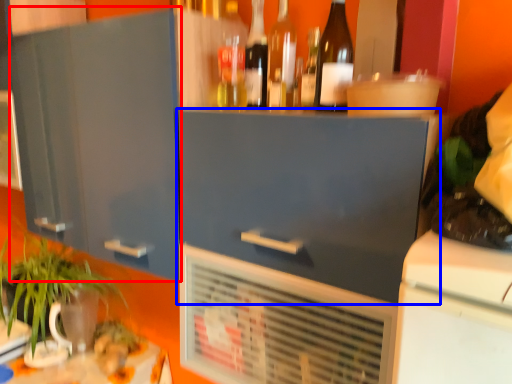
Question: Which point is further to the camera, cabinetry (highlighted by a red box) or cabinetry (highlighted by a blue box)?

Choices:
 (A) cabinetry
 (B) cabinetry

Answer: (A)